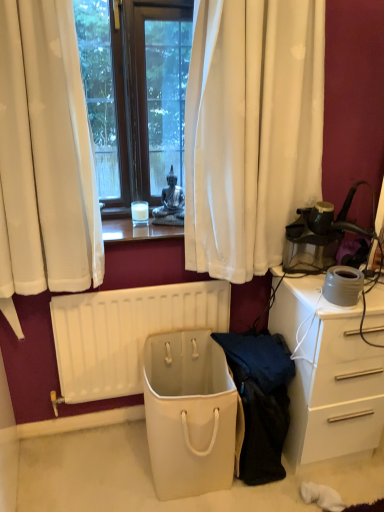
Question: From a real-world perspective, is white matte radiator at lower center positioned above or below beige fabric bag at center?

Choices:
 (A) above
 (B) below

Answer: (A)

Question: Is white matte radiator at lower center in front of or behind beige fabric bag at center in the image?

Choices:
 (A) behind
 (B) front

Answer: (A)

Question: Which of these objects is positioned farthest from the white glossy desk at right?

Choices:
 (A) beige fabric bag at center
 (B) white matte radiator at lower center
 (C) dark blue fabric at center
 (D) metallic statue at center

Answer: (D)

Question: Based on their relative distances, which object is nearer to the white matte radiator at lower center?

Choices:
 (A) beige fabric bag at center
 (B) dark blue fabric at center
 (C) metallic statue at center
 (D) white glossy desk at right

Answer: (A)